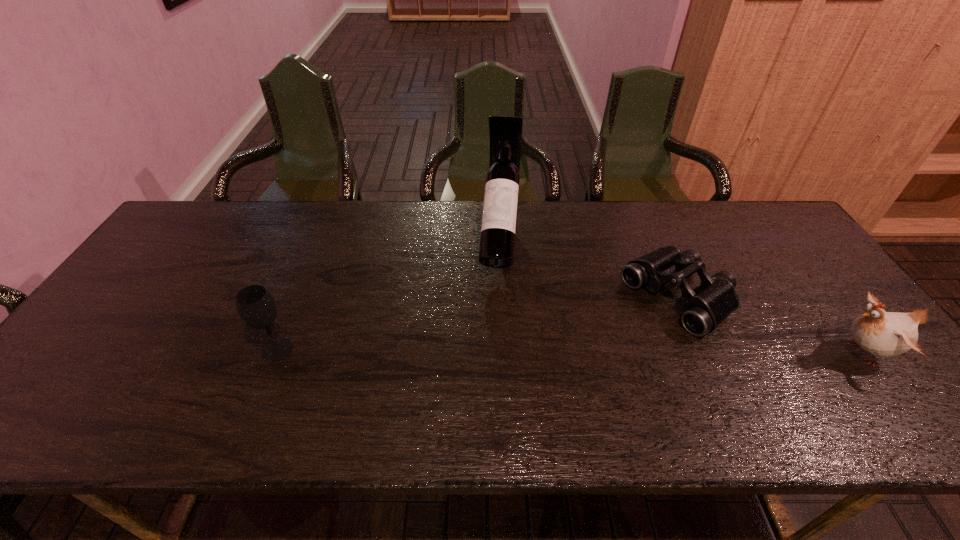
Locate an element on the screen. vacant region at the far edge of the desktop is located at coordinates (242, 237).

Locate an element on the screen. This screenshot has height=540, width=960. free location at the near edge of the desktop is located at coordinates (599, 376).

Identify the location of free space at the left edge. This screenshot has width=960, height=540. (160, 258).

Find the location of a particular element. The width and height of the screenshot is (960, 540). free point at the right edge is located at coordinates (804, 288).

The height and width of the screenshot is (540, 960). I want to click on free space at the far right corner of the desktop, so click(x=752, y=213).

Where is `free area in between the leftmost object and the wine bottle`? The width and height of the screenshot is (960, 540). free area in between the leftmost object and the wine bottle is located at coordinates (389, 295).

Locate an element on the screen. This screenshot has height=540, width=960. free point between the rightmost object and the tallest object is located at coordinates (681, 297).

At what (x,y) coordinates should I click in order to perform the action: click on vacant space in between the third object from right to left and the binoculars. Please return your answer as a coordinate pair (x, y). Looking at the image, I should click on (588, 270).

The width and height of the screenshot is (960, 540). I want to click on unoccupied area between the wine bottle and the bird, so click(681, 297).

This screenshot has height=540, width=960. In order to click on free spot between the tallest object and the bird in this screenshot , I will do `click(681, 297)`.